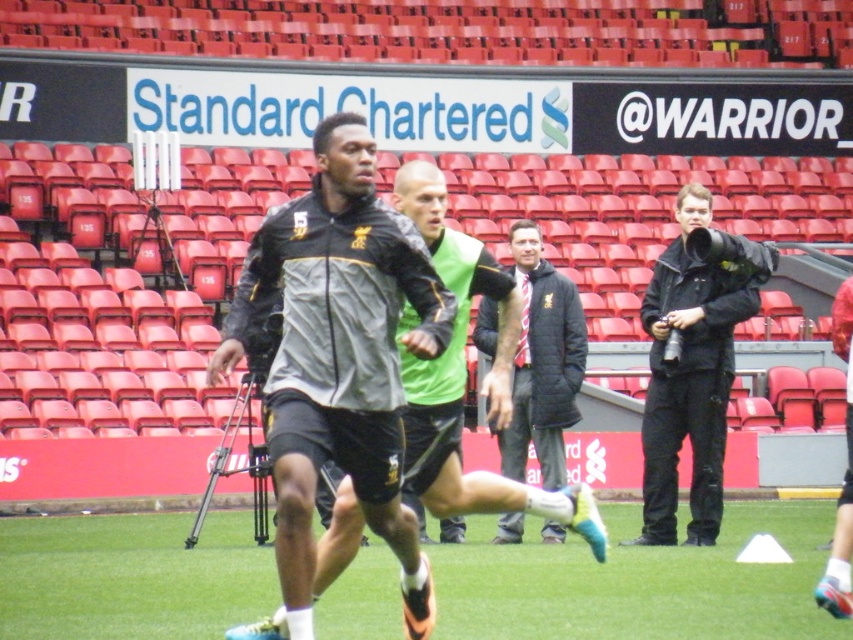
You are a photographer at the soccer training session. You need to take a photo that includes both the gray matte jacket at center and the dark gray jacket at center. Which one of the two jackets should you focus on first if you want to capture them both in the frame?

The gray matte jacket at center is positioned on the left side of dark gray jacket at center, so you should focus on the gray matte jacket at center first to ensure both are in the frame.

Based on the photo, you are a photographer standing at the edge of the soccer field. You need to capture a photo where both the green grass at center and the gray matte jacket at center are visible. Which object will occupy more horizontal space in the photo?

The green grass at center will occupy more horizontal space in the photo because its width surpasses that of the gray matte jacket at center.